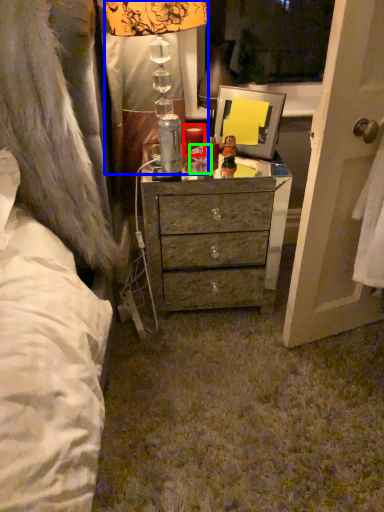
Question: Estimate the real-world distances between objects in this image. Which object is farther from candle (highlighted by a red box), lamp (highlighted by a blue box) or toy (highlighted by a green box)?

Choices:
 (A) lamp
 (B) toy

Answer: (A)